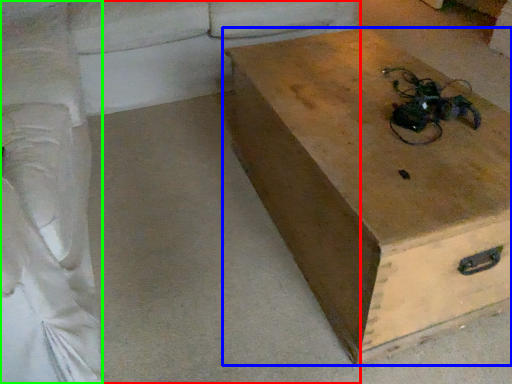
Question: Which is nearer to the studio couch (highlighted by a red box)? box (highlighted by a blue box) or couch (highlighted by a green box).

Choices:
 (A) box
 (B) couch

Answer: (B)